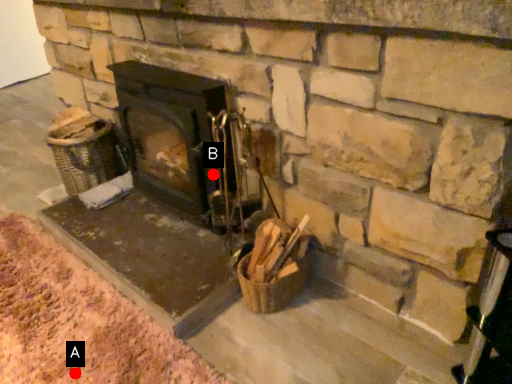
Question: Two points are circled on the image, labeled by A and B beside each circle. Which point is further to the camera?

Choices:
 (A) A is further
 (B) B is further

Answer: (B)